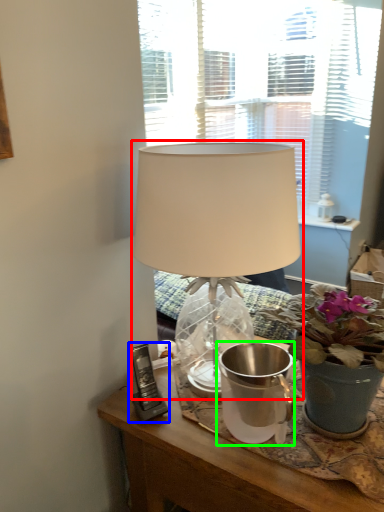
Question: Considering the real-world distances, which object is farthest from lamp (highlighted by a red box)? gadget (highlighted by a blue box) or watering can (highlighted by a green box)?

Choices:
 (A) gadget
 (B) watering can

Answer: (A)